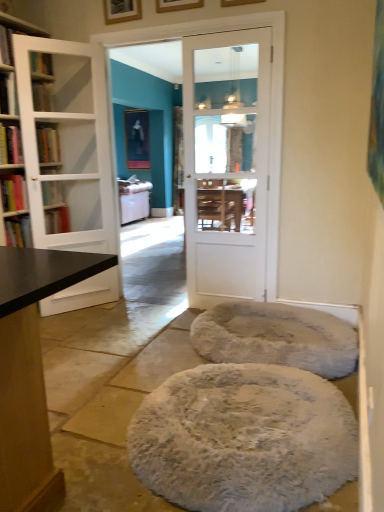
Identify the location of free space above white glass door at left, the 1th door in the left-to-right sequence (from a real-world perspective). (57, 40).